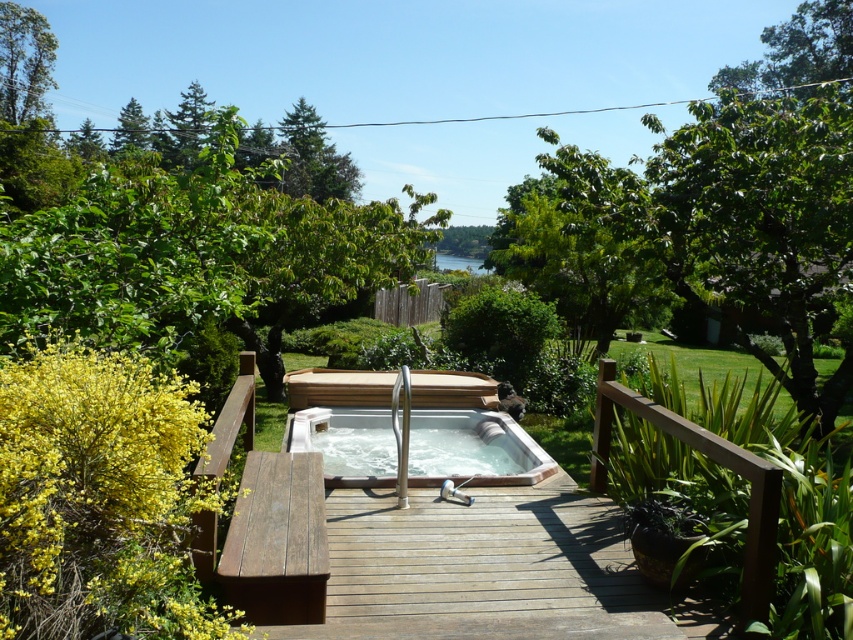
Question: Which point is closer to the camera?

Choices:
 (A) white glossy hot tub at center
 (B) brown wooden deck at center
 (C) green leafy tree at upper left

Answer: (B)

Question: Based on their relative distances, which object is nearer to the green leafy tree at upper left?

Choices:
 (A) brown wooden deck at center
 (B) white glossy hot tub at center

Answer: (B)

Question: Does white glossy hot tub at center have a smaller size compared to green leafy tree at upper left?

Choices:
 (A) no
 (B) yes

Answer: (A)

Question: Can you confirm if brown wooden deck at center is smaller than green leafy tree at upper left?

Choices:
 (A) yes
 (B) no

Answer: (B)

Question: Considering the relative positions of brown wooden deck at center and green leafy tree at upper left in the image provided, where is brown wooden deck at center located with respect to green leafy tree at upper left?

Choices:
 (A) below
 (B) above

Answer: (A)

Question: Among these objects, which one is nearest to the camera?

Choices:
 (A) brown wooden deck at center
 (B) green leafy tree at upper left
 (C) white glossy hot tub at center

Answer: (A)